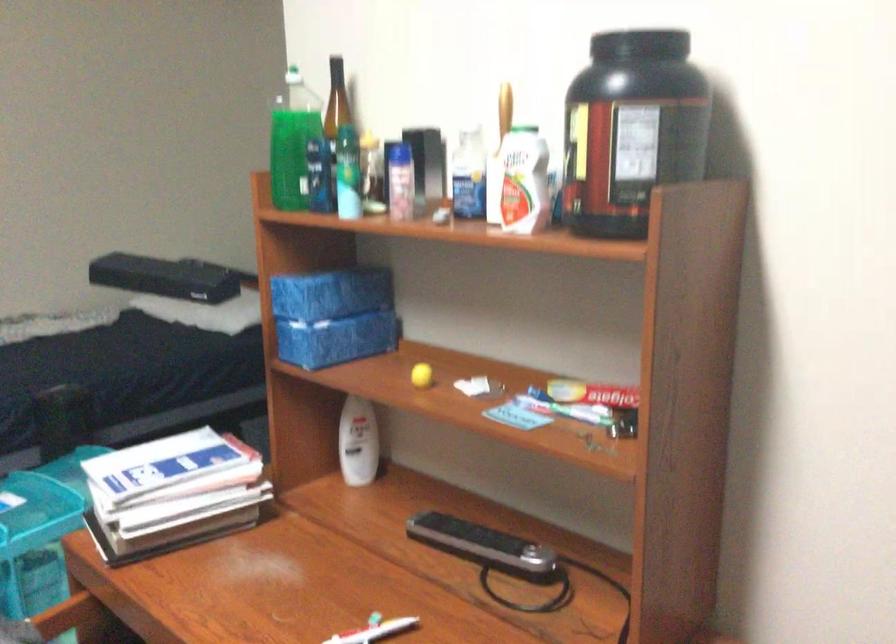
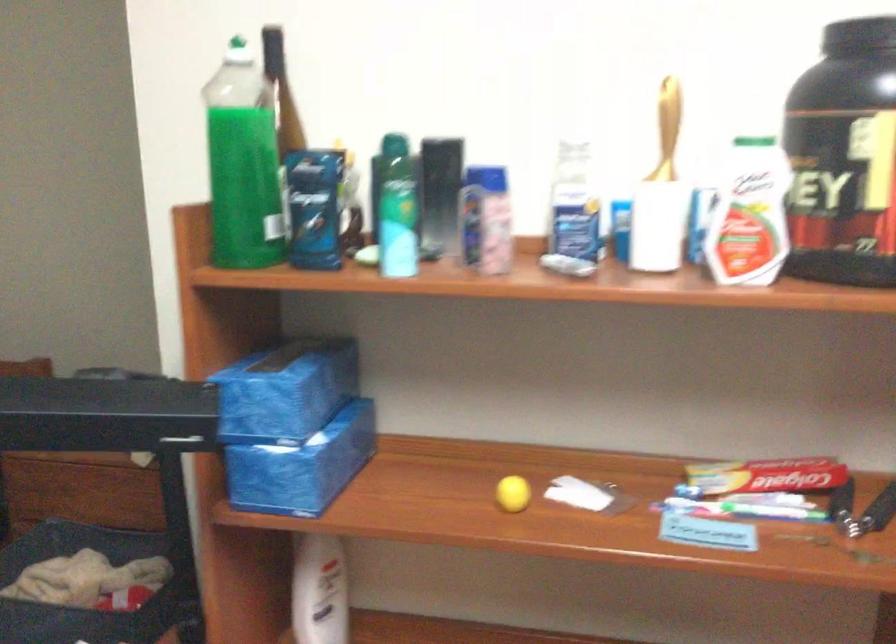
Find the pixel in the second image that matches point 300,287 in the first image.

(286, 391)